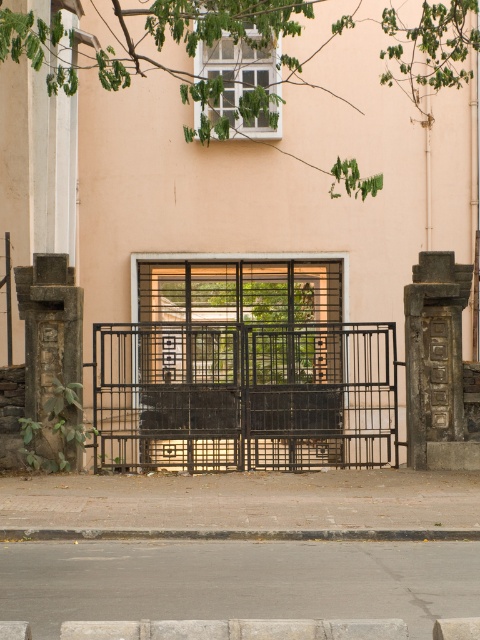
Question: Which point is closer to the camera taking this photo?

Choices:
 (A) (39, 616)
 (B) (106, 534)
 (C) (271, 344)

Answer: (A)

Question: Does gray concrete pavement at lower center have a larger size compared to gray concrete curb at lower center?

Choices:
 (A) no
 (B) yes

Answer: (B)

Question: Can you confirm if black metal gate at center is positioned to the left of gray concrete curb at lower center?

Choices:
 (A) no
 (B) yes

Answer: (A)

Question: Which of these objects is positioned farthest from the gray concrete curb at lower center?

Choices:
 (A) gray concrete pavement at lower center
 (B) black metal gate at center

Answer: (B)

Question: Which point is closer to the camera?

Choices:
 (A) gray concrete curb at lower center
 (B) gray concrete pavement at lower center
 (C) black metal gate at center

Answer: (B)

Question: Does gray concrete pavement at lower center have a smaller size compared to gray concrete curb at lower center?

Choices:
 (A) no
 (B) yes

Answer: (A)